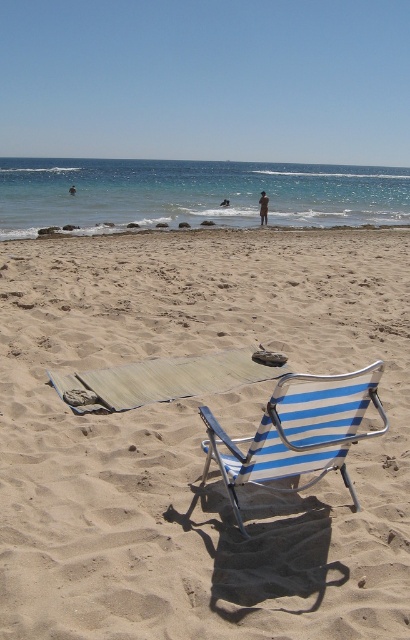
Question: Among these objects, which one is nearest to the camera?

Choices:
 (A) skinny man at center
 (B) smooth sand at lower center
 (C) beige sand at center

Answer: (C)

Question: Is beige sand at center to the left of skinny man at center from the viewer's perspective?

Choices:
 (A) no
 (B) yes

Answer: (A)

Question: Estimate the real-world distances between objects in this image. Which object is closer to the brown textured person at center?

Choices:
 (A) beige sand at center
 (B) blue striped fabric beach chair at center
 (C) skinny man at center

Answer: (C)

Question: From the image, what is the correct spatial relationship of blue striped fabric beach chair at center in relation to brown textured person at center?

Choices:
 (A) left
 (B) right

Answer: (A)

Question: Is beige sand at center wider than brown textured person at center?

Choices:
 (A) no
 (B) yes

Answer: (B)

Question: Which object is closer to the camera taking this photo?

Choices:
 (A) smooth sand at lower center
 (B) blue striped fabric beach chair at center
 (C) skinny man at center
 (D) beige sand at center

Answer: (D)